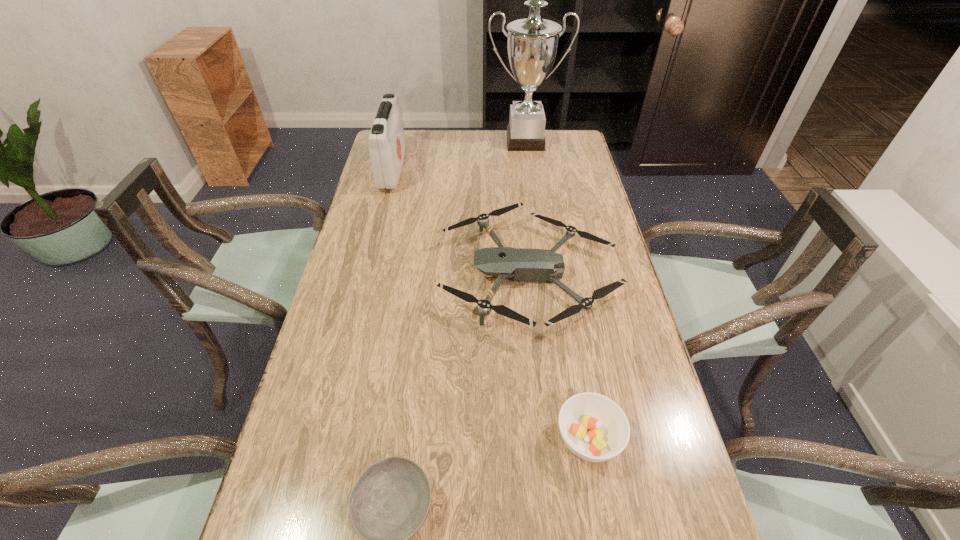
Find the location of a particular element. vacant region at the left edge of the desktop is located at coordinates (389, 274).

In the image, there is a desktop. At what (x,y) coordinates should I click in order to perform the action: click on vacant area at the right edge. Please return your answer as a coordinate pair (x, y). The width and height of the screenshot is (960, 540). Looking at the image, I should click on (597, 374).

You are a GUI agent. You are given a task and a screenshot of the screen. Output one action in this format:
    pyautogui.click(x=<x>, y=<y>)
    Task: Click on the free region at the far right corner
    
    Given the screenshot: What is the action you would take?
    pyautogui.click(x=547, y=148)

Locate an element on the screen. Image resolution: width=960 pixels, height=540 pixels. vacant space that is in between the first-aid kit and the trophy cup is located at coordinates (459, 156).

You are a GUI agent. You are given a task and a screenshot of the screen. Output one action in this format:
    pyautogui.click(x=<x>, y=<y>)
    Task: Click on the empty space that is in between the second tallest object and the tallest object
    
    Given the screenshot: What is the action you would take?
    pyautogui.click(x=459, y=156)

This screenshot has height=540, width=960. I want to click on empty space that is in between the leftmost object and the trophy cup, so click(459, 156).

You are a GUI agent. You are given a task and a screenshot of the screen. Output one action in this format:
    pyautogui.click(x=<x>, y=<y>)
    Task: Click on the empty location between the fourth shortest object and the drone
    Image resolution: width=960 pixels, height=540 pixels.
    Given the screenshot: What is the action you would take?
    pyautogui.click(x=461, y=222)

You are a GUI agent. You are given a task and a screenshot of the screen. Output one action in this format:
    pyautogui.click(x=<x>, y=<y>)
    Task: Click on the free spot between the fourth shortest object and the drone
    The image size is (960, 540).
    Given the screenshot: What is the action you would take?
    pyautogui.click(x=461, y=222)

Where is `free space between the third nearest object and the soup bowl`? Image resolution: width=960 pixels, height=540 pixels. free space between the third nearest object and the soup bowl is located at coordinates (559, 356).

Identify the location of blank region between the drone and the first-aid kit. (461, 222).